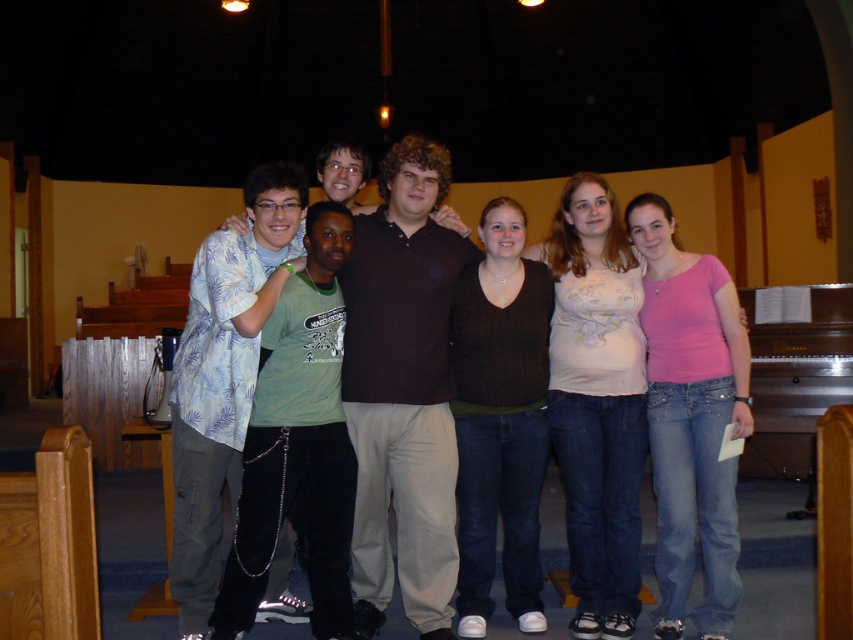
Question: Is light pink cotton shirt at center bigger than pink matte shirt at center?

Choices:
 (A) yes
 (B) no

Answer: (A)

Question: Which point is farther to the camera?

Choices:
 (A) (511, 310)
 (B) (213, 524)
 (C) (636, 515)
 (D) (640, 234)

Answer: (D)

Question: Which is nearer to the light blue floral shirt at center?

Choices:
 (A) pink matte shirt at center
 (B) light pink cotton shirt at center
 (C) dark brown sweater at center
 (D) brown cotton shirt at center

Answer: (D)

Question: Which point is farther to the camera?

Choices:
 (A) (282, 195)
 (B) (424, 400)
 (C) (497, 477)
 (D) (564, 186)

Answer: (D)

Question: Does light pink cotton shirt at center appear under light blue floral shirt at center?

Choices:
 (A) no
 (B) yes

Answer: (B)

Question: Does light blue floral shirt at center appear under dark brown sweater at center?

Choices:
 (A) yes
 (B) no

Answer: (B)